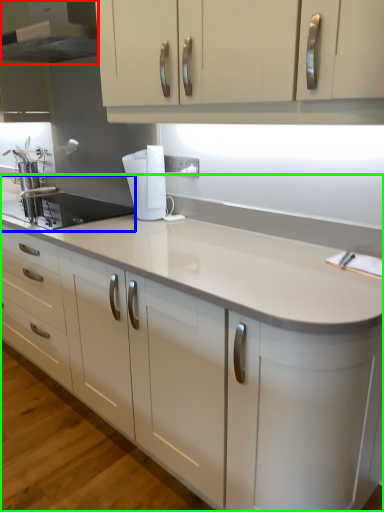
Question: Which object is positioned closest to home appliance (highlighted by a red box)? Select from sink (highlighted by a blue box) and countertop (highlighted by a green box).

Choices:
 (A) sink
 (B) countertop

Answer: (A)